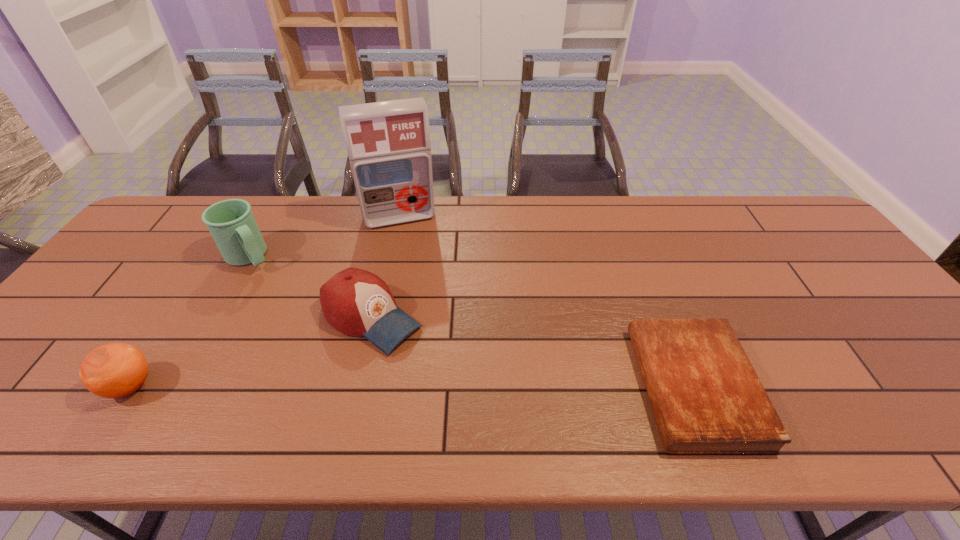
The height and width of the screenshot is (540, 960). Identify the location of vacant region between the second tallest object and the orange. (190, 321).

This screenshot has width=960, height=540. Identify the location of unoccupied area between the baseball cap and the farthest object. (385, 268).

I want to click on empty space between the orange and the rightmost object, so click(412, 386).

Find the location of a particular element. The height and width of the screenshot is (540, 960). free area in between the orange and the rightmost object is located at coordinates (412, 386).

What are the coordinates of `empty location between the orange and the shortest object` in the screenshot? It's located at pyautogui.click(x=412, y=386).

Where is `free space that is in between the mug and the orange`? The width and height of the screenshot is (960, 540). free space that is in between the mug and the orange is located at coordinates (190, 321).

I want to click on unoccupied area between the Bible and the orange, so click(412, 386).

The width and height of the screenshot is (960, 540). Find the location of `free space between the tallest object and the mug`. free space between the tallest object and the mug is located at coordinates (324, 238).

This screenshot has height=540, width=960. I want to click on free space between the first-aid kit and the baseball cap, so click(385, 268).

The image size is (960, 540). In order to click on object that ranks as the second closest to the second tallest object in this screenshot , I will do point(388,143).